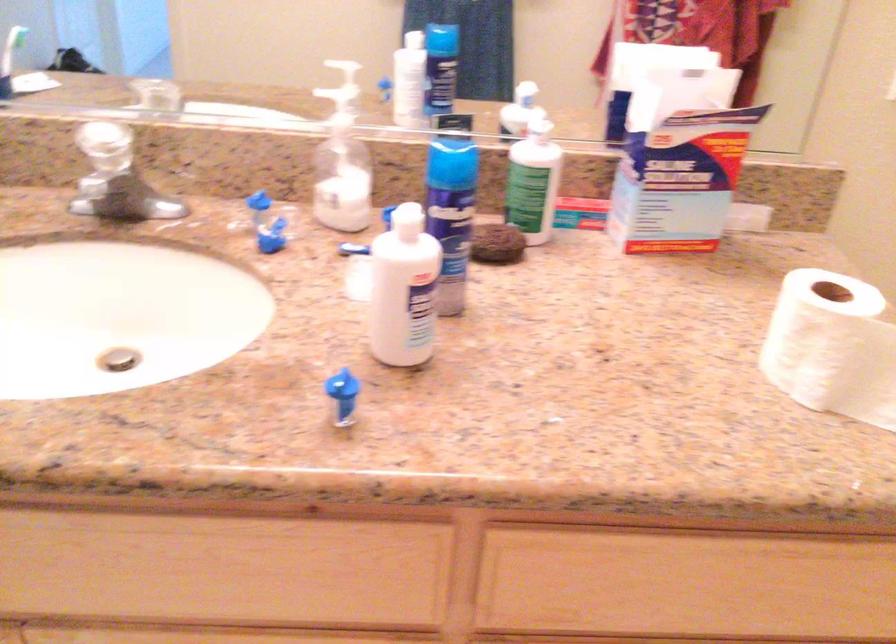
Which object does [496,243] point to?

This point indicates the brown round sponge.